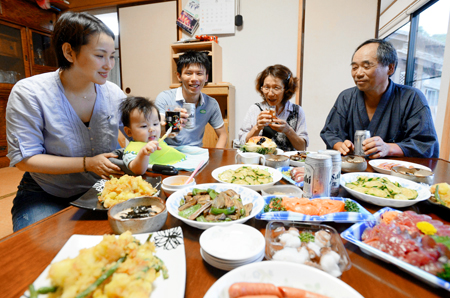
Locate an element on the screen. The height and width of the screenshot is (298, 450). small white plates is located at coordinates (254, 244).